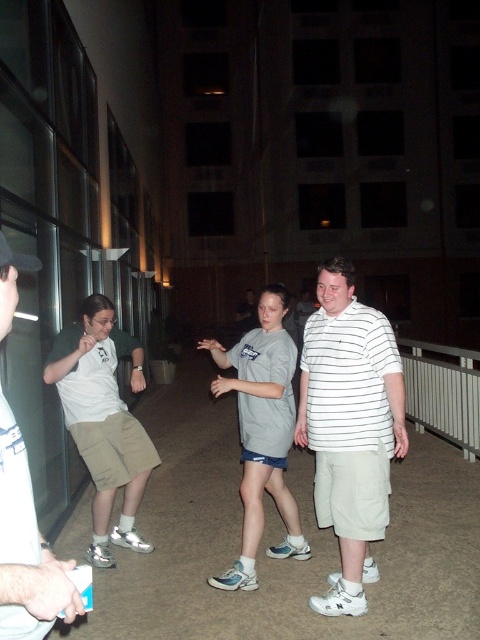
You are a photographer trying to capture a candid shot of the group. You are holding a camera and standing 3 meters away from the white striped shirt at center. Is your current distance sufficient to include all members of the group in the frame without zooming?

The camera and white striped shirt at center are 3.06 meters apart. Since you are standing 3 meters away, you are slightly closer than the required distance. To ensure all group members are in frame without zooming, you should move back approximately 6 centimeters.

You are a photographer trying to capture the matte khaki shorts at left in your shot. The camera is positioned at the point marked by coordinates point [104,420]. Can you confirm if the camera is positioned directly at the location of the matte khaki shorts at left?

Yes, the camera is positioned exactly at the location of the matte khaki shorts at left since the point [104,420] indicates that location.